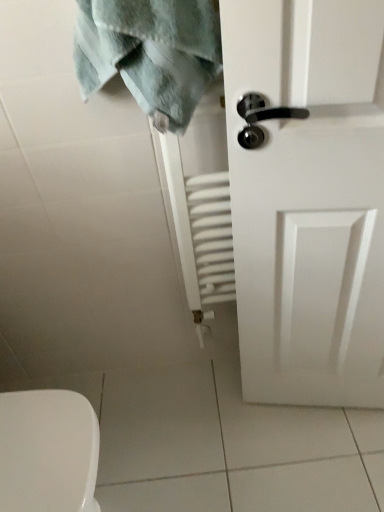
Question: In the image, is green textured towel at upper left positioned in front of or behind white matte door at right?

Choices:
 (A) behind
 (B) front

Answer: (A)

Question: From a real-world perspective, is green textured towel at upper left above or below white matte door at right?

Choices:
 (A) above
 (B) below

Answer: (A)

Question: Is green textured towel at upper left wider or thinner than white matte door at right?

Choices:
 (A) wide
 (B) thin

Answer: (A)

Question: Based on their sizes in the image, would you say white matte door at right is bigger or smaller than green textured towel at upper left?

Choices:
 (A) big
 (B) small

Answer: (A)

Question: Is white matte door at right wider or thinner than green textured towel at upper left?

Choices:
 (A) thin
 (B) wide

Answer: (A)

Question: Choose the correct answer: Is white matte door at right inside green textured towel at upper left or outside it?

Choices:
 (A) outside
 (B) inside

Answer: (A)

Question: Is point pos(235,129) positioned closer to the camera than point pos(178,124)?

Choices:
 (A) farther
 (B) closer

Answer: (B)